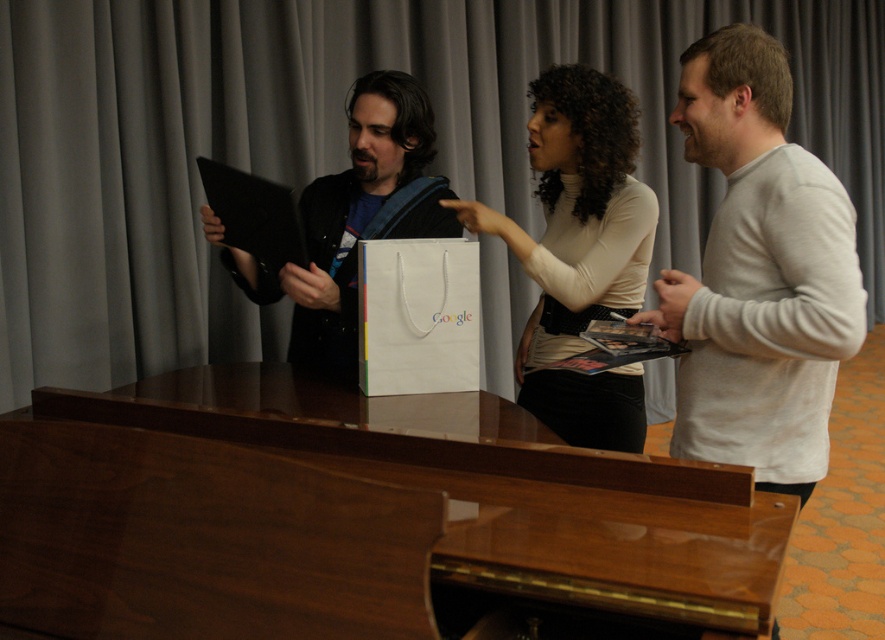
You are organizing a small event and need to place the white cotton sweater at right and the white paper bag at center on a shelf. Based on their widths, which item should you place first to ensure they both fit?

The white cotton sweater at right might be wider than the white paper bag at center, so you should place the white paper bag at center first to accommodate the wider sweater.

You are organizing a small event and need to decide whether to place a decorative item on the white paper bag at center. Considering the size of the gray fabric curtain at upper center, do you think the bag can accommodate the item without being overwhelmed?

The gray fabric curtain at upper center is wider than the white paper bag at center, so placing a decorative item on the white paper bag at center may make it appear overwhelmed due to the bag being smaller in size compared to the curtain.